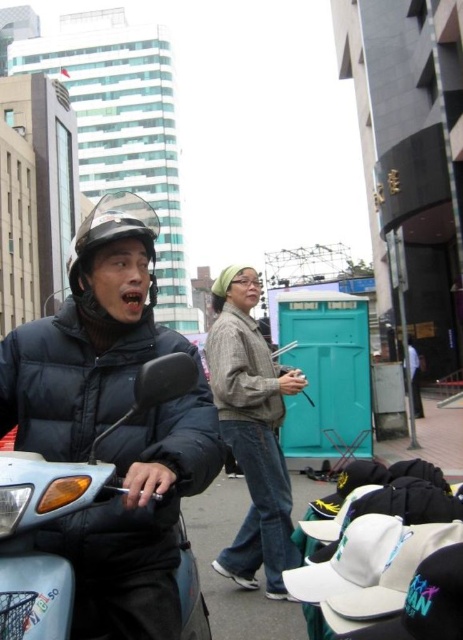
Which is in front, point (60, 490) or point (218, 388)?

Point (60, 490)

Does light blue plastic motorcycle at left have a greater width compared to knitted beige sweater at center?

No, light blue plastic motorcycle at left is not wider than knitted beige sweater at center.

Does point (193, 560) lie in front of point (243, 582)?

Yes, point (193, 560) is closer to viewer.

At what (x,y) coordinates should I click in order to perform the action: click on light blue plastic motorcycle at left. Please return your answer as a coordinate pair (x, y). The width and height of the screenshot is (463, 640). Looking at the image, I should click on (62, 512).

Does point (279, 454) come farther from viewer compared to point (412, 534)?

That is True.

Who is more forward, (255,461) or (379,602)?

Point (379,602) is more forward.

Measure the distance between knitted beige sweater at center and camera.

A distance of 1.87 meters exists between knitted beige sweater at center and camera.

You are a GUI agent. You are given a task and a screenshot of the screen. Output one action in this format:
    pyautogui.click(x=<x>, y=<y>)
    Task: Click on the knitted beige sweater at center
    The width and height of the screenshot is (463, 640).
    Given the screenshot: What is the action you would take?
    pyautogui.click(x=251, y=432)

Based on the photo, does white matte baseball hat at lower center have a greater width compared to matte black helmet at center?

Incorrect, white matte baseball hat at lower center's width does not surpass matte black helmet at center's.

Is the position of white matte baseball hat at lower center more distant than that of matte black helmet at center?

No, white matte baseball hat at lower center is closer to the viewer.

Which is in front, point (342, 600) or point (86, 244)?

Positioned in front is point (342, 600).

Image resolution: width=463 pixels, height=640 pixels. I want to click on white matte baseball hat at lower center, so click(x=369, y=566).